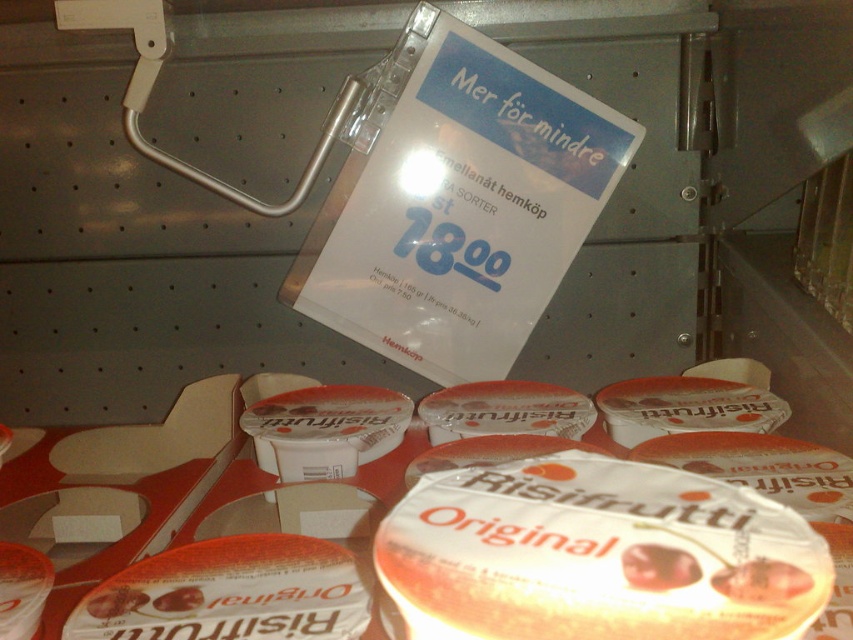
Question: Does translucent plastic cup at center appear under white matte risifrutti original at center?

Choices:
 (A) yes
 (B) no

Answer: (B)

Question: Can you confirm if white plastic sign at upper center is smaller than white matte risifrutti original at center?

Choices:
 (A) no
 (B) yes

Answer: (A)

Question: Does white plastic sign at upper center have a smaller size compared to white matte risifrutti original at center?

Choices:
 (A) no
 (B) yes

Answer: (A)

Question: Among these points, which one is nearest to the camera?

Choices:
 (A) (352, 614)
 (B) (534, 168)

Answer: (A)

Question: Which of the following is the farthest from the observer?

Choices:
 (A) white matte risifrutti original at center
 (B) translucent plastic cup at center
 (C) white plastic sign at upper center

Answer: (C)

Question: Considering the real-world distances, which object is farthest from the translucent plastic cup at center?

Choices:
 (A) white plastic sign at upper center
 (B) white matte risifrutti original at center

Answer: (A)